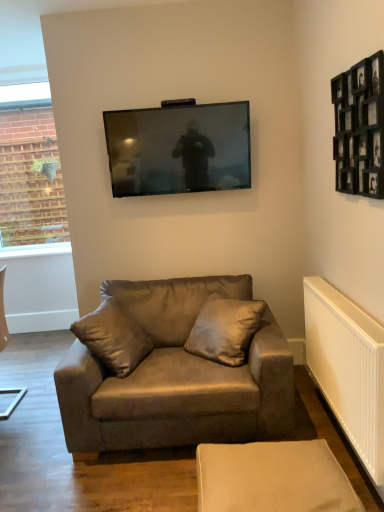
Question: Is the depth of matte black tv at upper center less than that of white plastic radiator at lower right?

Choices:
 (A) yes
 (B) no

Answer: (B)

Question: Is matte black tv at upper center to the right of white plastic radiator at lower right from the viewer's perspective?

Choices:
 (A) yes
 (B) no

Answer: (B)

Question: Can you confirm if matte black tv at upper center is bigger than white plastic radiator at lower right?

Choices:
 (A) yes
 (B) no

Answer: (A)

Question: Considering the relative sizes of matte black tv at upper center and white plastic radiator at lower right in the image provided, is matte black tv at upper center thinner than white plastic radiator at lower right?

Choices:
 (A) yes
 (B) no

Answer: (B)

Question: From a real-world perspective, is matte black tv at upper center under white plastic radiator at lower right?

Choices:
 (A) no
 (B) yes

Answer: (A)

Question: In terms of size, does white plastic radiator at lower right appear bigger or smaller than black wooden picture frame at upper right?

Choices:
 (A) big
 (B) small

Answer: (B)

Question: Considering the relative positions of white plastic radiator at lower right and black wooden picture frame at upper right in the image provided, is white plastic radiator at lower right to the left or to the right of black wooden picture frame at upper right?

Choices:
 (A) left
 (B) right

Answer: (B)

Question: Is white plastic radiator at lower right in front of or behind black wooden picture frame at upper right in the image?

Choices:
 (A) behind
 (B) front

Answer: (A)

Question: Does point (347, 301) appear closer or farther from the camera than point (370, 138)?

Choices:
 (A) farther
 (B) closer

Answer: (A)

Question: From the image's perspective, is beige fabric ottoman at lower center above or below white plastic radiator at lower right?

Choices:
 (A) above
 (B) below

Answer: (B)

Question: From a real-world perspective, is beige fabric ottoman at lower center positioned above or below white plastic radiator at lower right?

Choices:
 (A) below
 (B) above

Answer: (A)

Question: In terms of height, does beige fabric ottoman at lower center look taller or shorter compared to white plastic radiator at lower right?

Choices:
 (A) tall
 (B) short

Answer: (B)

Question: Considering the positions of point (241, 443) and point (345, 307), is point (241, 443) closer or farther from the camera than point (345, 307)?

Choices:
 (A) farther
 (B) closer

Answer: (A)

Question: From the image's perspective, is white plastic radiator at lower right located above or below matte black tv at upper center?

Choices:
 (A) below
 (B) above

Answer: (A)

Question: Considering their positions, is white plastic radiator at lower right located in front of or behind matte black tv at upper center?

Choices:
 (A) behind
 (B) front

Answer: (B)